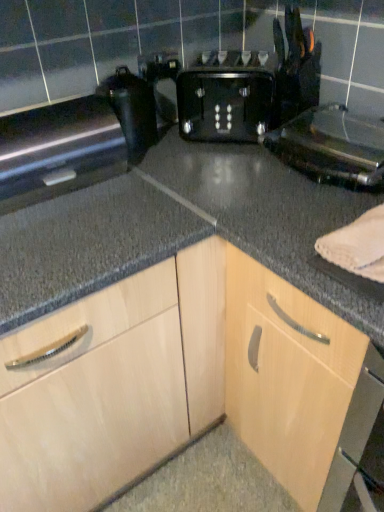
Identify the location of free location above light wood cabinet at center (from a real-world perspective). This screenshot has height=512, width=384. (258, 186).